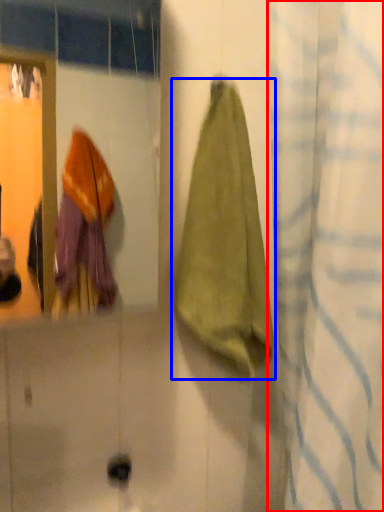
Question: Which of the following is the closest to the observer, curtain (highlighted by a red box) or towel (highlighted by a blue box)?

Choices:
 (A) curtain
 (B) towel

Answer: (A)